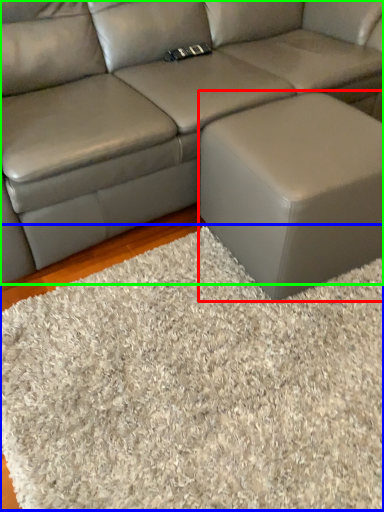
Question: Estimate the real-world distances between objects in this image. Which object is farther from stool (highlighted by a red box), mat (highlighted by a blue box) or studio couch (highlighted by a green box)?

Choices:
 (A) mat
 (B) studio couch

Answer: (B)